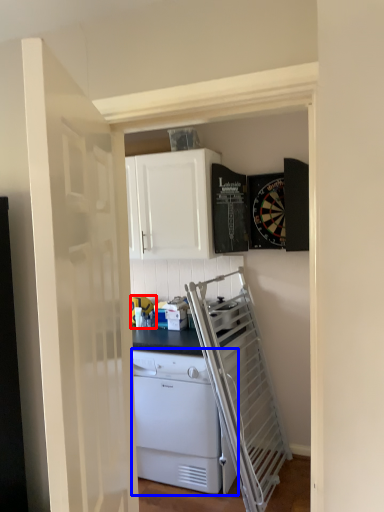
Question: Which of the following is the closest to the observer, appliance (highlighted by a red box) or home appliance (highlighted by a blue box)?

Choices:
 (A) appliance
 (B) home appliance

Answer: (B)